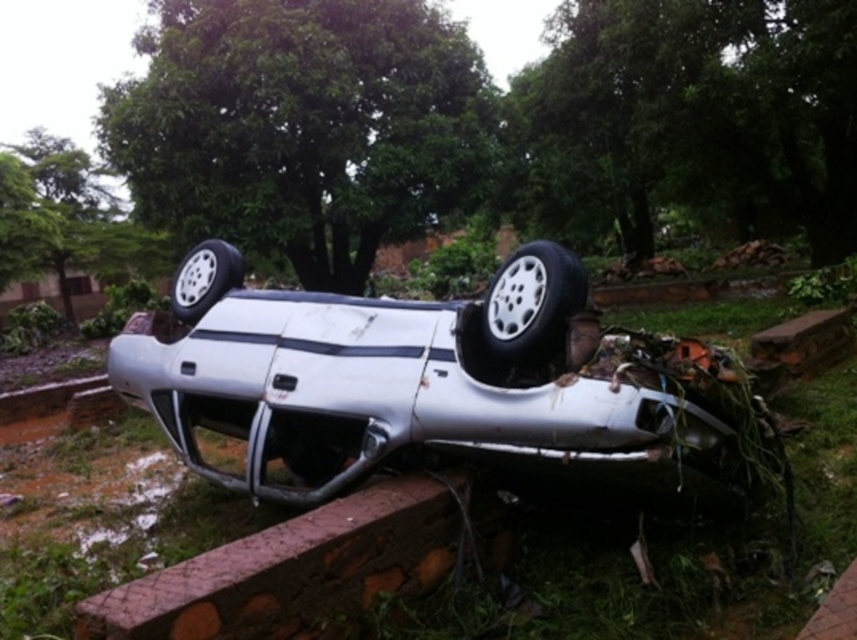
Question: Which of these objects is positioned farthest from the white rubber tire at center?

Choices:
 (A) brown textured curb at lower center
 (B) silver metallic tire at center
 (C) white matte car at center

Answer: (B)

Question: Does silver metallic tire at center lie behind white rubber tire at center?

Choices:
 (A) yes
 (B) no

Answer: (B)

Question: Among these objects, which one is farthest from the camera?

Choices:
 (A) white matte car at center
 (B) silver metallic tire at center

Answer: (B)

Question: Considering the relative positions of white matte car at center and silver metallic tire at center in the image provided, where is white matte car at center located with respect to silver metallic tire at center?

Choices:
 (A) right
 (B) left

Answer: (B)

Question: Does white matte car at center have a smaller size compared to silver metallic tire at center?

Choices:
 (A) yes
 (B) no

Answer: (B)

Question: Estimate the real-world distances between objects in this image. Which object is farther from the white matte car at center?

Choices:
 (A) brown textured curb at lower center
 (B) white rubber tire at center

Answer: (B)